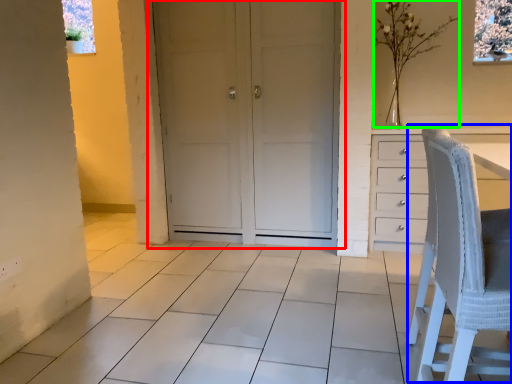
Question: Estimate the real-world distances between objects in this image. Which object is closer to door (highlighted by a red box), rocking chair (highlighted by a blue box) or flower (highlighted by a green box)?

Choices:
 (A) rocking chair
 (B) flower

Answer: (B)